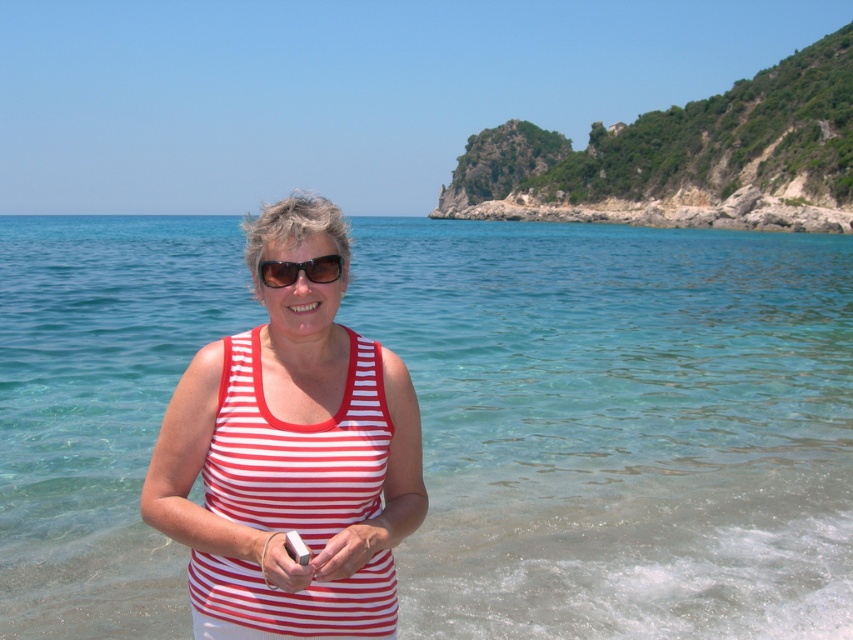
You are a photographer standing at the beach scene. You want to take a photo that includes both the person in the foreground and the rocky coastline on the right. Which of the two points, point (329, 518) or point (334, 268), is closer to your camera position?

Point (329, 518) is closer to the camera than point (334, 268).

You are a photographer trying to capture the perfect shot of the white striped tank top at center and the black plastic sunglasses at center. Since you want to ensure both items are in frame, can you tell me which direction the sunglasses are relative to the tank top?

The white striped tank top at center is to the left of black plastic sunglasses at center, so the sunglasses are to the right of the tank top.